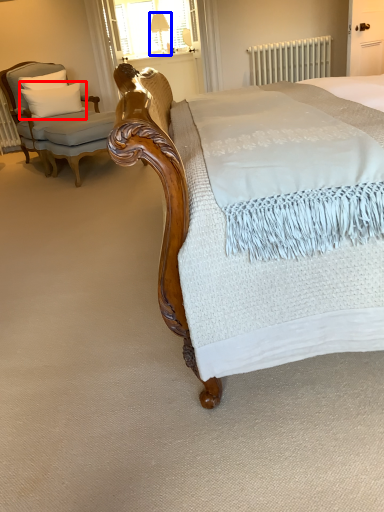
Question: Which object appears closest to the camera in this image, pillow (highlighted by a red box) or table lamp (highlighted by a blue box)?

Choices:
 (A) pillow
 (B) table lamp

Answer: (A)